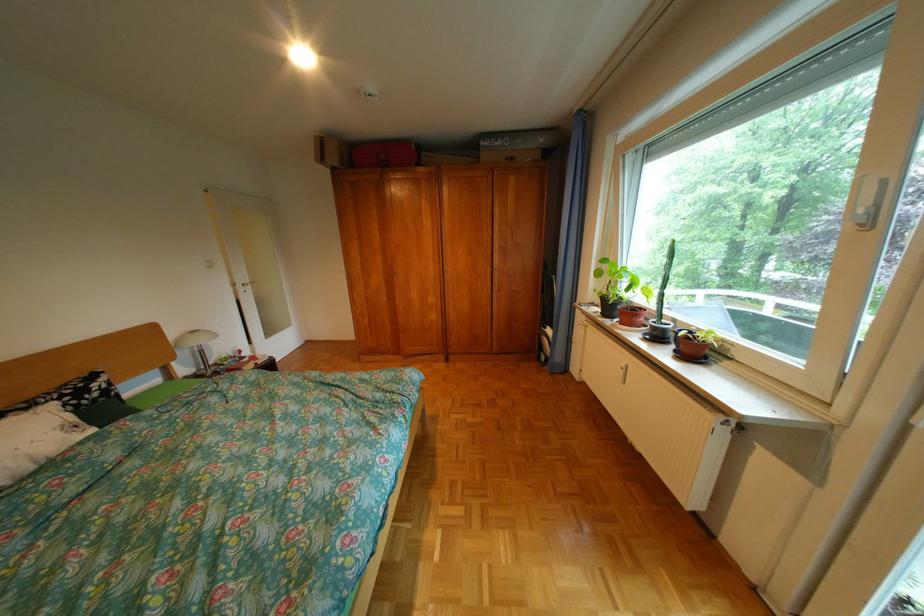
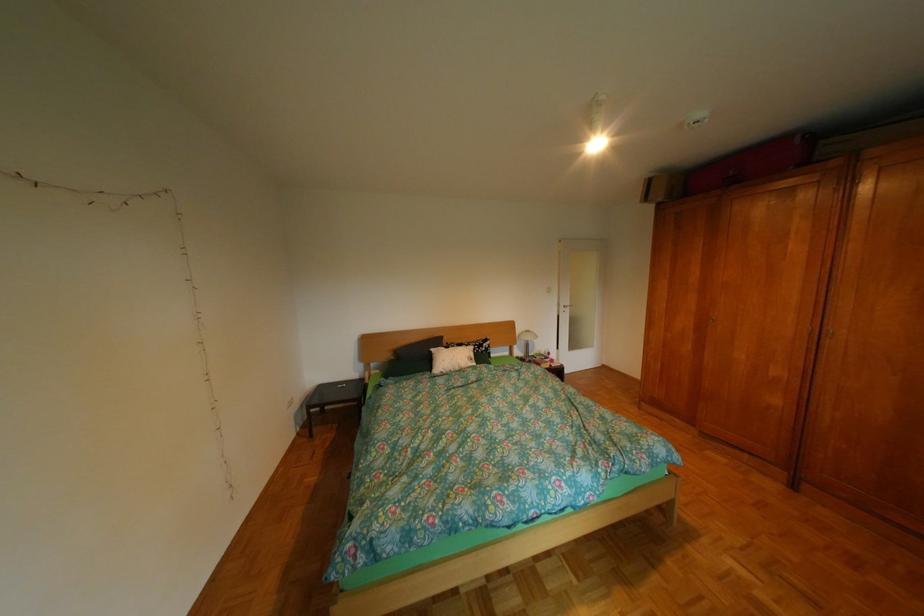
Question: The camera is either moving clockwise (left) or counter-clockwise (right) around the object. The first image is from the beginning of the video and the second image is from the end. Is the camera moving left or right when shooting the video?

Choices:
 (A) Left
 (B) Right

Answer: (B)